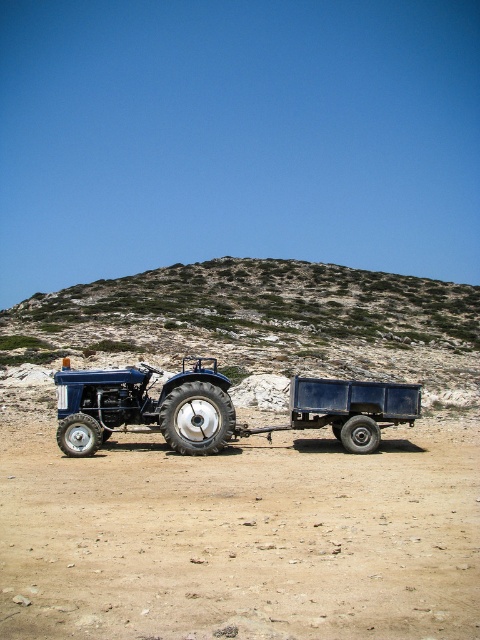
Question: Is green rocky hillside at upper center wider than blue matte trailer truck at center?

Choices:
 (A) yes
 (B) no

Answer: (A)

Question: Which object is the farthest from the matte blue tractor at center?

Choices:
 (A) brown sandy soil at center
 (B) rubber/textured tire at center
 (C) blue matte trailer truck at center

Answer: (A)

Question: Among these objects, which one is farthest from the camera?

Choices:
 (A) rubber/textured tire at center
 (B) rubber/textured tire at lower left

Answer: (A)

Question: Where is rubber/textured tire at center located in relation to black rubber tire at center in the image?

Choices:
 (A) above
 (B) below

Answer: (A)

Question: Which of the following is the closest to the observer?

Choices:
 (A) (211, 420)
 (B) (330, 636)
 (C) (217, 397)
 (D) (297, 426)

Answer: (B)

Question: From the image, what is the correct spatial relationship of blue matte trailer truck at center in relation to black rubber tire at center?

Choices:
 (A) left
 (B) right

Answer: (A)